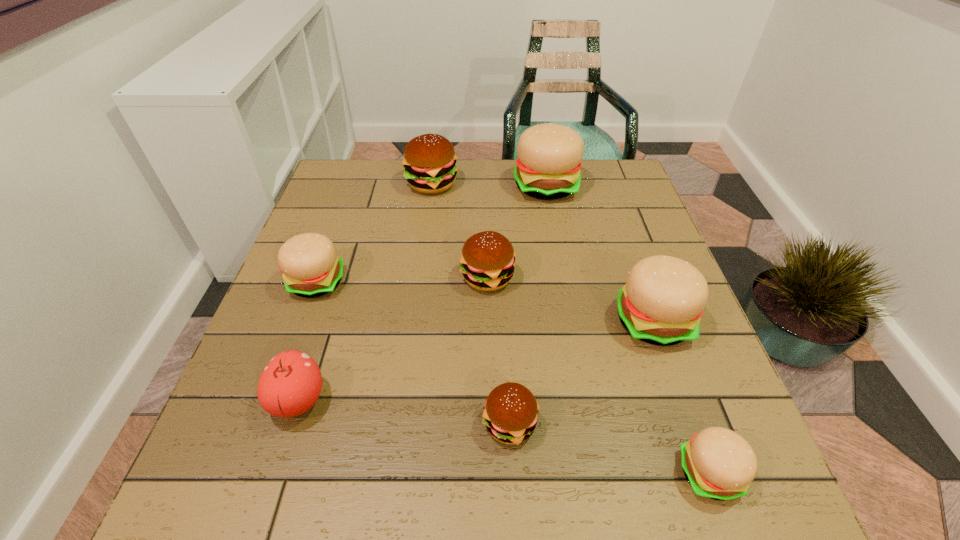
Find the location of `the biggest beige hamburger`. the biggest beige hamburger is located at coordinates (548, 166).

Locate an element on the screen. the sixth object from right to left is located at coordinates (429, 160).

Image resolution: width=960 pixels, height=540 pixels. I want to click on the farthest brown hamburger, so click(x=429, y=160).

You are a GUI agent. You are given a task and a screenshot of the screen. Output one action in this format:
    pyautogui.click(x=<x>, y=<y>)
    Task: Click on the third smallest beige hamburger
    This screenshot has height=540, width=960.
    Given the screenshot: What is the action you would take?
    pyautogui.click(x=664, y=297)

I want to click on the second farthest brown hamburger, so click(x=487, y=263).

You are a GUI agent. You are given a task and a screenshot of the screen. Output one action in this format:
    pyautogui.click(x=<x>, y=<y>)
    Task: Click on the leftmost beige hamburger
    The height and width of the screenshot is (540, 960).
    Given the screenshot: What is the action you would take?
    pyautogui.click(x=311, y=268)

This screenshot has height=540, width=960. I want to click on the leftmost hamburger, so click(x=311, y=268).

At what (x,y) coordinates should I click in order to perform the action: click on apple. Please return your answer as a coordinate pair (x, y). Looking at the image, I should click on (290, 384).

Where is `the smallest brown hamburger`? the smallest brown hamburger is located at coordinates (511, 410).

Locate an element on the screen. This screenshot has height=540, width=960. the nearest beige hamburger is located at coordinates (720, 464).